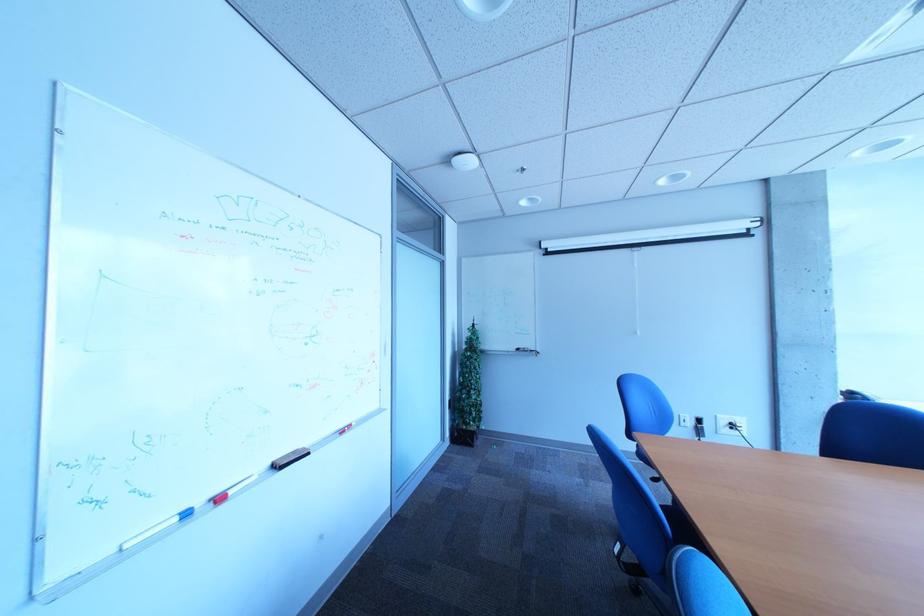
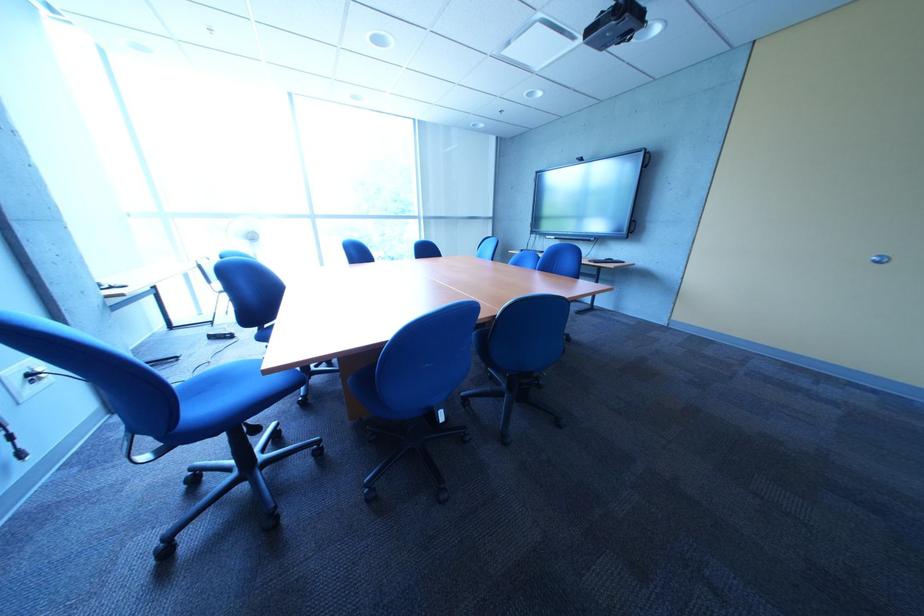
Locate, in the second image, the point that corresponds to (748,426) in the first image.

(46, 377)